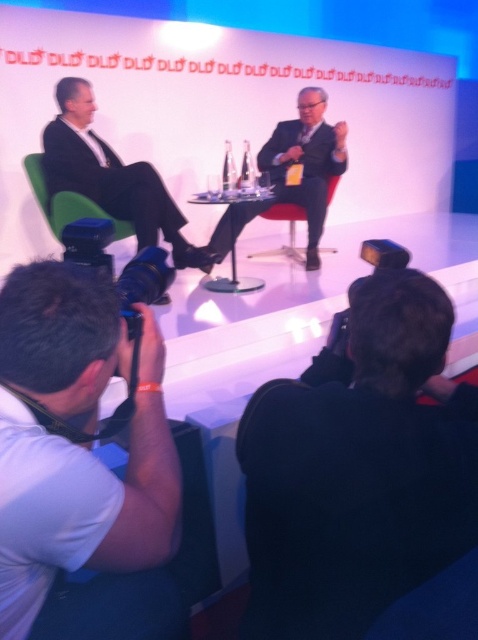
Consider the image. You are a photographer at the event and want to position yourself to capture both individuals on stage clearly. Given the white fabric camera at lower left is placed at coordinates 0.817 on the x axis and 0.190 on the y axis, what is the best way to adjust your position to ensure both speakers are in frame?

The white fabric camera at lower left is positioned at coordinates 0.817 on the x axis and 0.190 on the y axis. To capture both speakers clearly, you should position yourself centrally between them, ensuring the camera is angled to include both individuals within the frame.

You are a photographer at the event and need to adjust your equipment. You have a white fabric camera at lower left and a matte black suit at center in your view. Which object is located more to the left?

The white fabric camera at lower left is positioned more to the left than the matte black suit at center.

You are a photographer who needs to adjust the height of your white fabric camera at lower left to match the height of the matte black suit at center. Based on the scene, can you determine if you need to raise or lower the camera?

The white fabric camera at lower left is shorter than the matte black suit at center, so you need to raise the camera to match the height of the matte black suit at center.